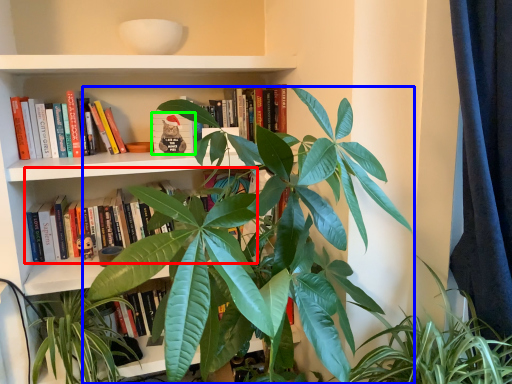
Question: Which object is positioned closest to book (highlighted by a red box)? Select from houseplant (highlighted by a blue box) and book (highlighted by a green box).

Choices:
 (A) houseplant
 (B) book

Answer: (B)